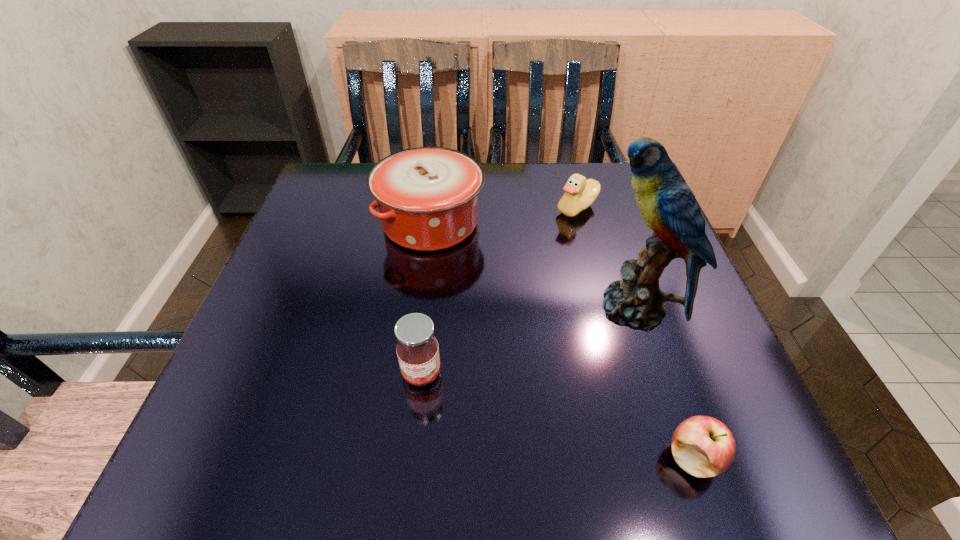
Where is `parrot located at the right edge`? This screenshot has width=960, height=540. parrot located at the right edge is located at coordinates (668, 207).

The height and width of the screenshot is (540, 960). I want to click on duck that is at the right edge, so click(580, 193).

Where is `apple present at the right edge`? apple present at the right edge is located at coordinates (704, 447).

Identify the location of object that is at the far right corner. (580, 193).

This screenshot has width=960, height=540. I want to click on object that is positioned at the near right corner, so click(x=704, y=447).

This screenshot has width=960, height=540. Find the location of `vacant space at the far edge`. vacant space at the far edge is located at coordinates (543, 168).

Find the location of `free region at the near edge`. free region at the near edge is located at coordinates (308, 444).

Locate an element on the screen. vacant area at the left edge is located at coordinates (x=224, y=409).

Locate an element on the screen. The width and height of the screenshot is (960, 540). vacant space at the right edge of the desktop is located at coordinates (603, 261).

In the image, there is a desktop. Where is `free region at the far left corner`? Image resolution: width=960 pixels, height=540 pixels. free region at the far left corner is located at coordinates (338, 172).